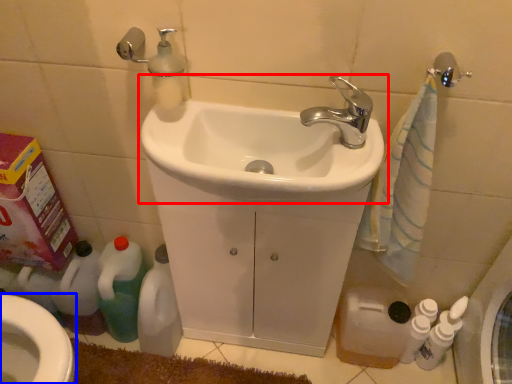
Question: Which object is closer to the camera taking this photo, sink (highlighted by a red box) or bidet (highlighted by a blue box)?

Choices:
 (A) sink
 (B) bidet

Answer: (A)